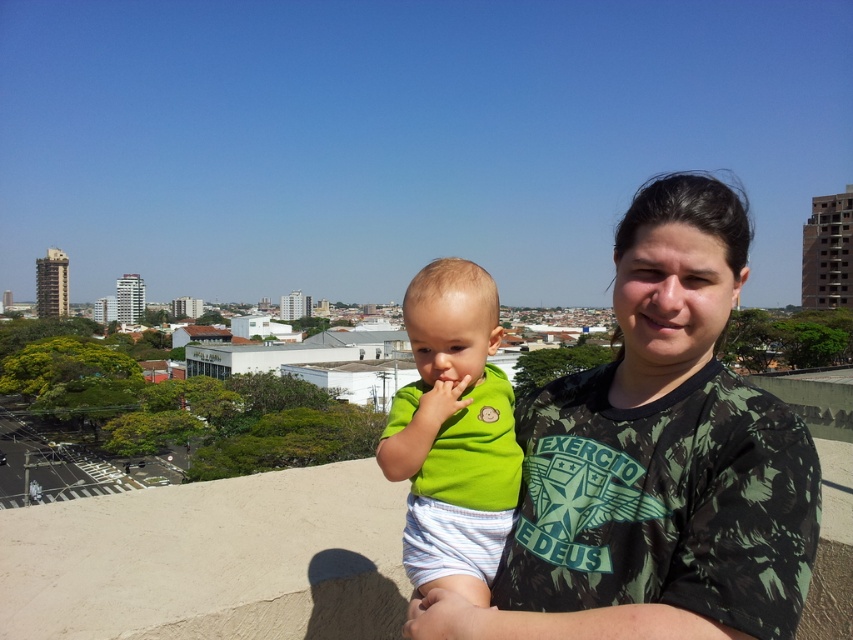
Please describe the position of the green camouflage shirt at center in terms of coordinates within the image frame. The image frame has a coordinate system where the bottom left corner is the origin point. The x and y axes increase to the right and upwards respectively. The coordinates are normalized between 0 and 1. Please provide the coordinates as a pair of numbers in parentheses separated by a comma, without any units.

The green camouflage shirt at center is located at coordinates point (666,445).

You are a photographer trying to capture a clear photo of both the green camouflage shirt at center and the green matte shirt at center. Which one should you focus on first to ensure it appears sharp in the photo?

The green camouflage shirt at center is in front of the green matte shirt at center, so you should focus on the green camouflage shirt at center first to ensure it appears sharp.

You are a photographer trying to capture a clear shot of both the green camouflage shirt at center and the green matte shirt at center. Since they are overlapping, which one is covering part of the other?

The green camouflage shirt at center is positioned over green matte shirt at center, so it is covering part of the green matte shirt at center.